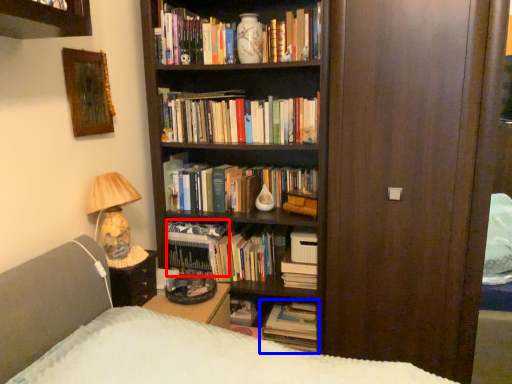
Question: Which object is closer to the camera taking this photo, book (highlighted by a red box) or book (highlighted by a blue box)?

Choices:
 (A) book
 (B) book

Answer: (B)